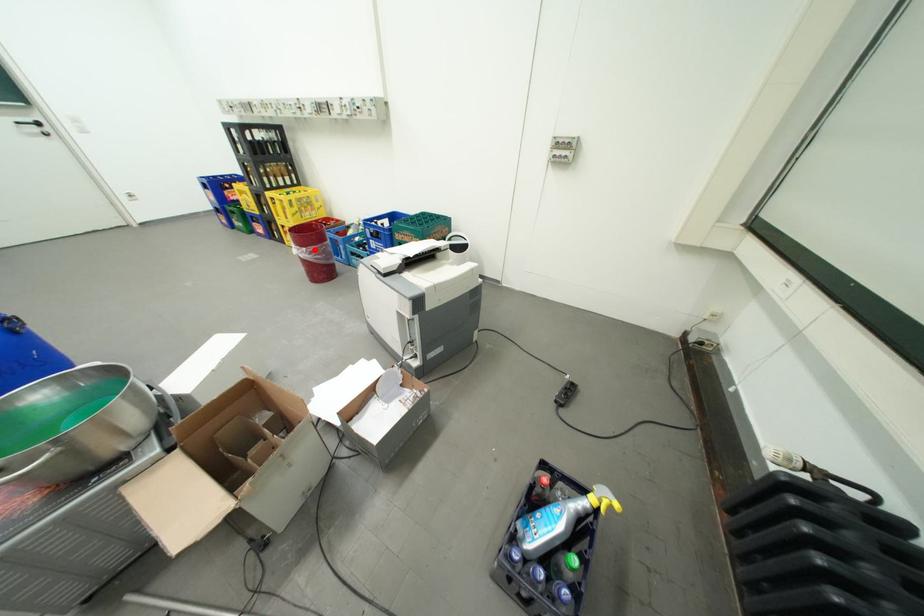
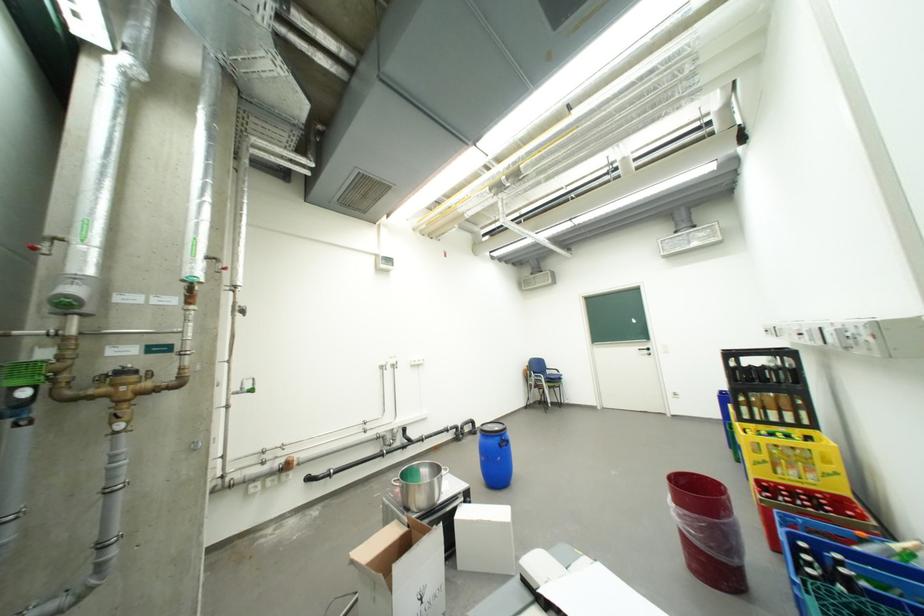
In the second image, find the point that corresponds to the highlighted location in the first image.

(685, 507)